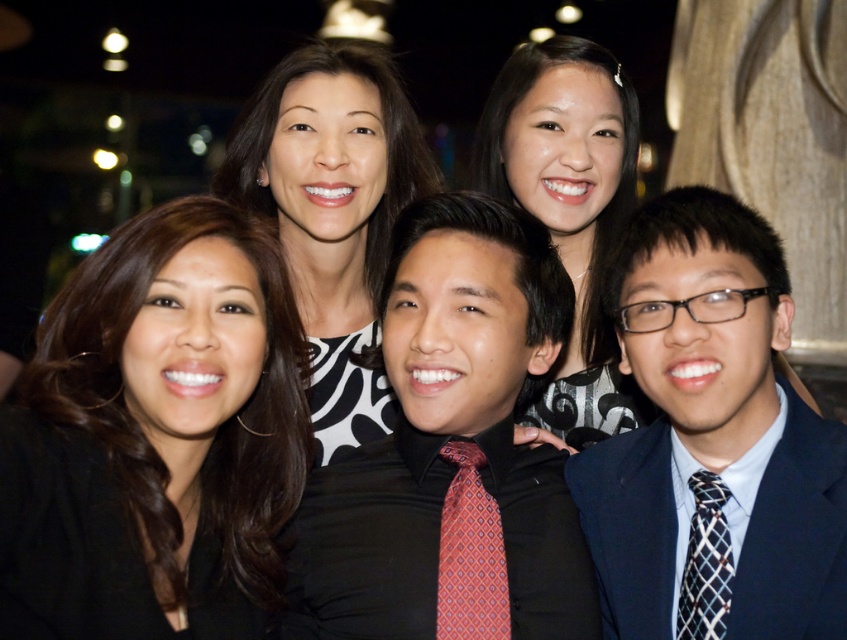
Based on the photo, you are a photographer who needs to adjust the lighting for the black satin shirt at center and the red silk tie at center. Which one is located to the left of the other?

The red silk tie at center is located to the left of the black satin shirt at center because the black satin shirt at center is positioned on the right side of the red silk tie at center.

In the nighttime group photo, there are several people dressed in formal attire. The scene includes a stone facade on the right and blurred city lights in the background. You notice a point at coordinates (x=331, y=212). What object is located at this point?

The point at coordinates (x=331, y=212) indicates the location of the matte black dress at center.